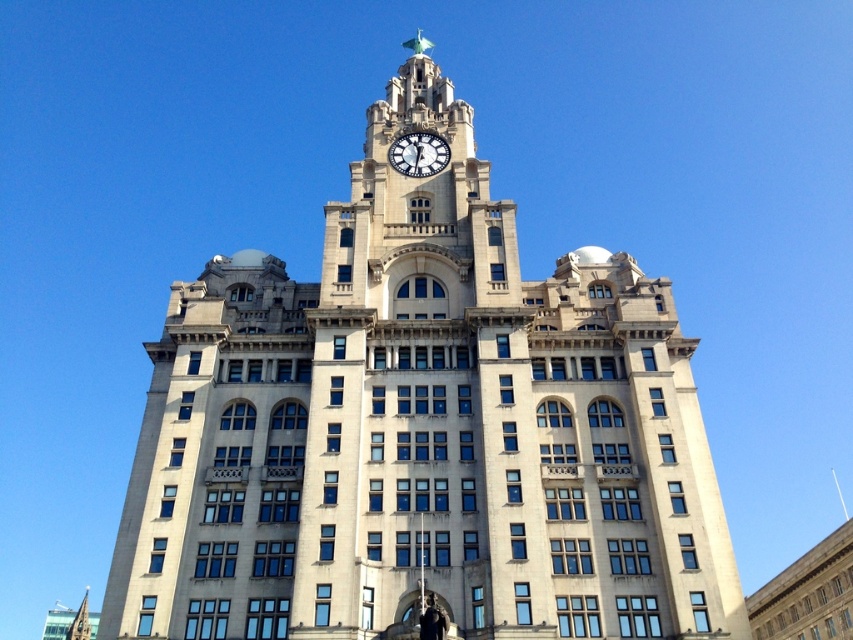
Question: Can you confirm if white stone clock tower at center is wider than white marble clock at center?

Choices:
 (A) yes
 (B) no

Answer: (A)

Question: Among these points, which one is farthest from the camera?

Choices:
 (A) (422, 282)
 (B) (403, 156)

Answer: (B)

Question: Which point is farther to the camera?

Choices:
 (A) white marble clock at center
 (B) white stone clock tower at center

Answer: (A)

Question: Observing the image, what is the correct spatial positioning of white stone clock tower at center in reference to white marble clock at center?

Choices:
 (A) right
 (B) left

Answer: (B)

Question: Where is white stone clock tower at center located in relation to white marble clock at center in the image?

Choices:
 (A) right
 (B) left

Answer: (B)